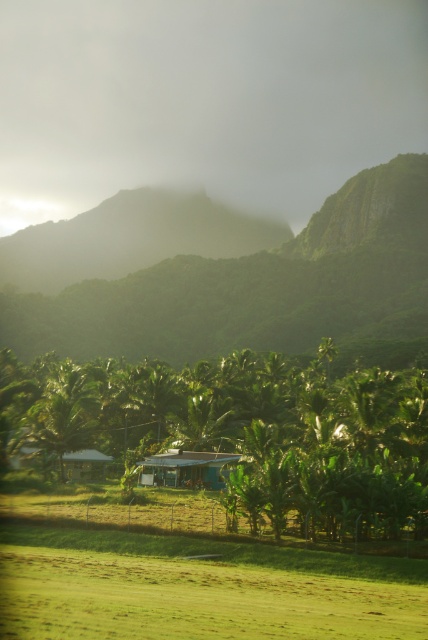
Question: Can you confirm if green matte mountain at center is positioned above green corrugated metal hut at center?

Choices:
 (A) yes
 (B) no

Answer: (A)

Question: Is green matte mountain at center positioned behind green corrugated metal hut at center?

Choices:
 (A) no
 (B) yes

Answer: (B)

Question: Which of these objects is positioned closest to the green matte hut at center?

Choices:
 (A) green corrugated metal hut at center
 (B) green leafy mountain at upper center
 (C) green matte mountain at center

Answer: (A)

Question: Which is nearer to the green matte hut at center?

Choices:
 (A) green leafy tree at lower center
 (B) green matte mountain at center
 (C) green corrugated metal hut at center
 (D) green leafy mountain at upper center

Answer: (C)

Question: Is green leafy tree at lower center positioned in front of green matte mountain at center?

Choices:
 (A) yes
 (B) no

Answer: (A)

Question: Which is farther from the green matte mountain at center?

Choices:
 (A) green matte hut at center
 (B) green corrugated metal hut at center
 (C) green leafy mountain at upper center

Answer: (B)